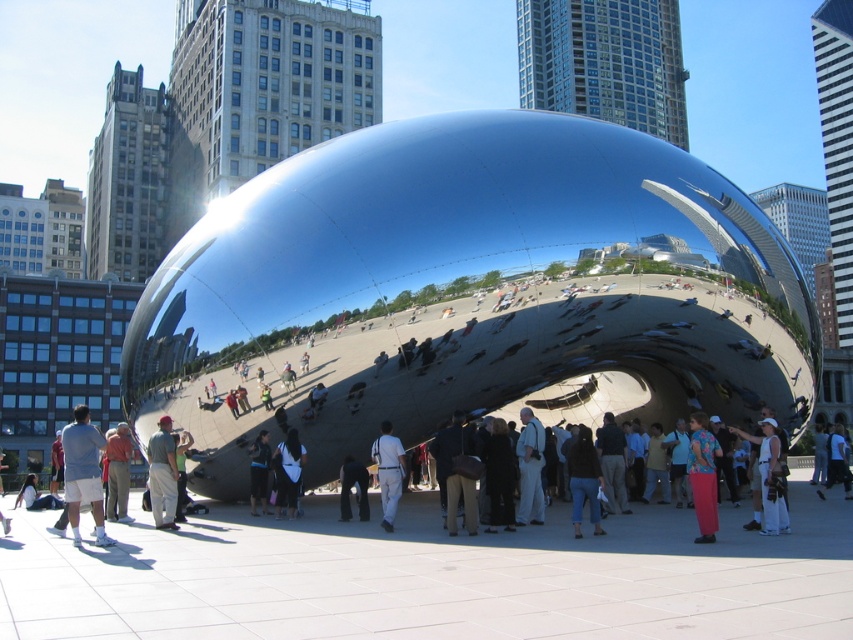
Is the position of dark brown leather jacket at center more distant than that of white cotton shirt at lower left?

No, dark brown leather jacket at center is closer to the viewer.

Can you confirm if dark brown leather jacket at center is thinner than white cotton shirt at lower left?

Yes.

Is point (582, 502) behind point (1, 524)?

No, (582, 502) is closer to viewer.

Where is `dark brown leather jacket at center`? This screenshot has height=640, width=853. dark brown leather jacket at center is located at coordinates (584, 481).

Who is taller, dark brown leather jacket at center or light gray pants at center?

light gray pants at center is taller.

Does dark brown leather jacket at center have a greater width compared to light gray pants at center?

Incorrect, dark brown leather jacket at center's width does not surpass light gray pants at center's.

At what (x,y) coordinates should I click in order to perform the action: click on dark brown leather jacket at center. Please return your answer as a coordinate pair (x, y). This screenshot has height=640, width=853. Looking at the image, I should click on (584, 481).

Image resolution: width=853 pixels, height=640 pixels. I want to click on dark brown leather jacket at center, so click(584, 481).

From the picture: Which is below, floral shirt at center or white cotton shirt at lower left?

white cotton shirt at lower left is lower down.

Can you confirm if floral shirt at center is smaller than white cotton shirt at lower left?

Yes, floral shirt at center is smaller than white cotton shirt at lower left.

Image resolution: width=853 pixels, height=640 pixels. I want to click on floral shirt at center, so click(x=703, y=476).